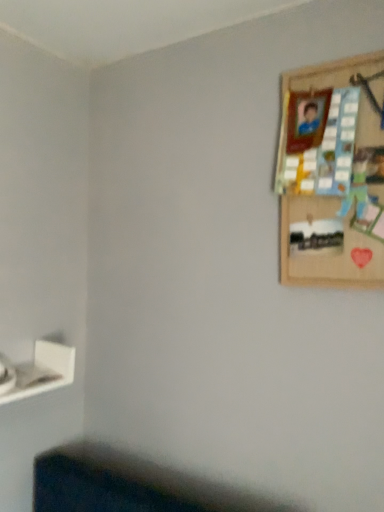
Question: Should I look upward or downward to see wooden picture frame at upper right?

Choices:
 (A) up
 (B) down

Answer: (A)

Question: Considering the relative sizes of white matte shelf at lower left and wooden picture frame at upper right in the image provided, is white matte shelf at lower left bigger than wooden picture frame at upper right?

Choices:
 (A) no
 (B) yes

Answer: (A)

Question: Is white matte shelf at lower left further to camera compared to wooden picture frame at upper right?

Choices:
 (A) yes
 (B) no

Answer: (A)

Question: From a real-world perspective, is white matte shelf at lower left located higher than wooden picture frame at upper right?

Choices:
 (A) no
 (B) yes

Answer: (A)

Question: Is white matte shelf at lower left oriented away from wooden picture frame at upper right?

Choices:
 (A) no
 (B) yes

Answer: (A)

Question: Can you confirm if white matte shelf at lower left is wider than wooden picture frame at upper right?

Choices:
 (A) no
 (B) yes

Answer: (B)

Question: Can you confirm if white matte shelf at lower left is shorter than wooden picture frame at upper right?

Choices:
 (A) yes
 (B) no

Answer: (A)

Question: Considering the relative positions of wooden picture frame at upper right and white matte shelf at lower left in the image provided, is wooden picture frame at upper right behind white matte shelf at lower left?

Choices:
 (A) yes
 (B) no

Answer: (B)

Question: From the image's perspective, would you say wooden picture frame at upper right is positioned over white matte shelf at lower left?

Choices:
 (A) no
 (B) yes

Answer: (B)

Question: From the image's perspective, does wooden picture frame at upper right appear lower than white matte shelf at lower left?

Choices:
 (A) no
 (B) yes

Answer: (A)

Question: Is wooden picture frame at upper right aimed at white matte shelf at lower left?

Choices:
 (A) no
 (B) yes

Answer: (A)

Question: Considering the relative positions of wooden picture frame at upper right and white matte shelf at lower left in the image provided, is wooden picture frame at upper right to the left of white matte shelf at lower left from the viewer's perspective?

Choices:
 (A) no
 (B) yes

Answer: (A)

Question: Would you say wooden picture frame at upper right is a long distance from white matte shelf at lower left?

Choices:
 (A) yes
 (B) no

Answer: (B)

Question: Relative to white matte shelf at lower left, is wooden picture frame at upper right in front or behind?

Choices:
 (A) front
 (B) behind

Answer: (A)